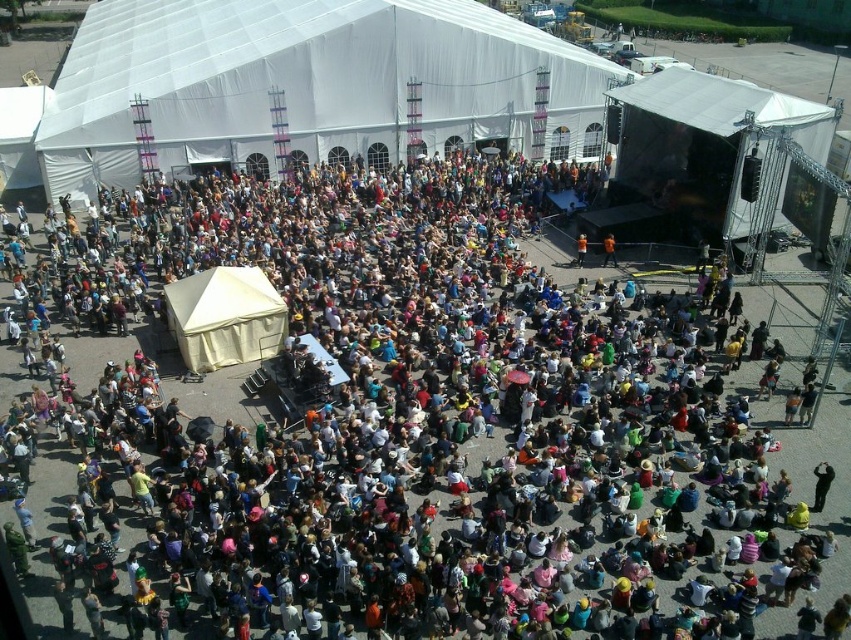
You are a photographer positioned near the white matte tent at upper right and need to capture a clear shot of the camera. Given that you have a camera lens with a maximum zoom range of 100 meters, will you be able to take a clear photo of the camera from your current position?

The white matte tent at upper right and camera are 42.84 meters apart. Since your camera lens has a maximum zoom range of 100 meters, which is greater than the distance between them, you can take a clear photo of the camera from your current position near the white matte tent at upper right.

You are planning to set up a food stall at this event. You have two options for tents to use. The white matte tent at upper right and the white canvas tent at center. Which tent would provide more space for your stall?

The white matte tent at upper right is bigger than the white canvas tent at center, so it would provide more space for your stall.

You are at the event and need to locate the registration booth. The registration booth is under the white fabric canopy at upper center. From the white canvas tent at center, in which direction should you go to reach the registration booth?

The white fabric canopy at upper center is to the left of the white canvas tent at center, so you should go left from the white canvas tent at center to reach the registration booth.